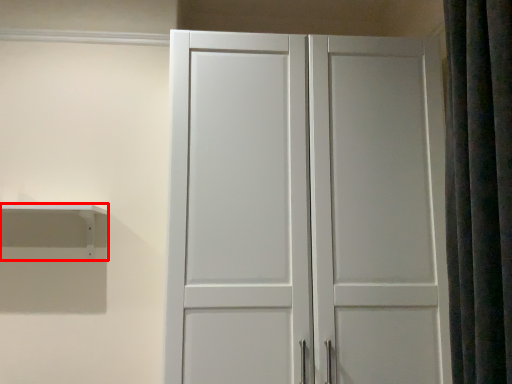
Question: From the image's perspective, what is the correct spatial positioning of shelf (annotated by the red box) in reference to shower curtain?

Choices:
 (A) below
 (B) above

Answer: (A)